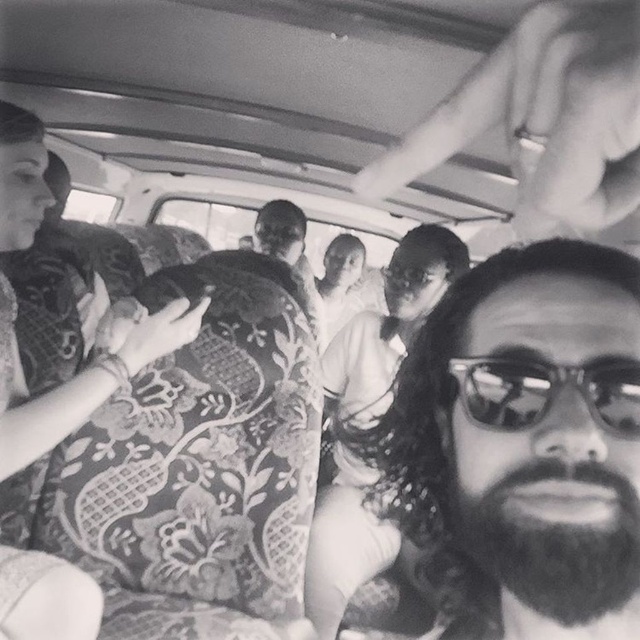
Who is more forward, (541, 605) or (468, 380)?

Point (541, 605) is more forward.

Does dark brown thick beard at lower right come in front of sunglasses at center?

That is True.

This screenshot has height=640, width=640. In order to click on dark brown thick beard at lower right in this screenshot , I will do `click(554, 540)`.

I want to click on dark brown thick beard at lower right, so click(x=554, y=540).

Which of these two, bearded man at center or smooth skin man at center, stands shorter?

With less height is bearded man at center.

Who is taller, bearded man at center or smooth skin man at center?

smooth skin man at center

Which is in front, point (608, 438) or point (301, 250)?

Point (608, 438)

The image size is (640, 640). Find the location of `bearded man at center`. bearded man at center is located at coordinates (522, 445).

I want to click on sunglasses at center, so click(x=547, y=392).

Which is behind, point (632, 426) or point (264, 250)?

The point (264, 250) is behind.

The width and height of the screenshot is (640, 640). Describe the element at coordinates (547, 392) in the screenshot. I see `sunglasses at center` at that location.

Locate an element on the screen. The height and width of the screenshot is (640, 640). sunglasses at center is located at coordinates (547, 392).